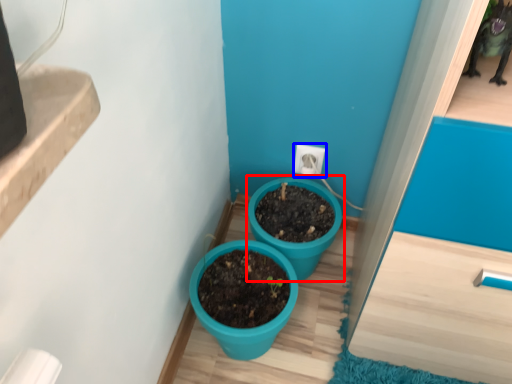
Question: Which object is closer to the camera taking this photo, flowerpot (highlighted by a red box) or electric outlet (highlighted by a blue box)?

Choices:
 (A) flowerpot
 (B) electric outlet

Answer: (A)